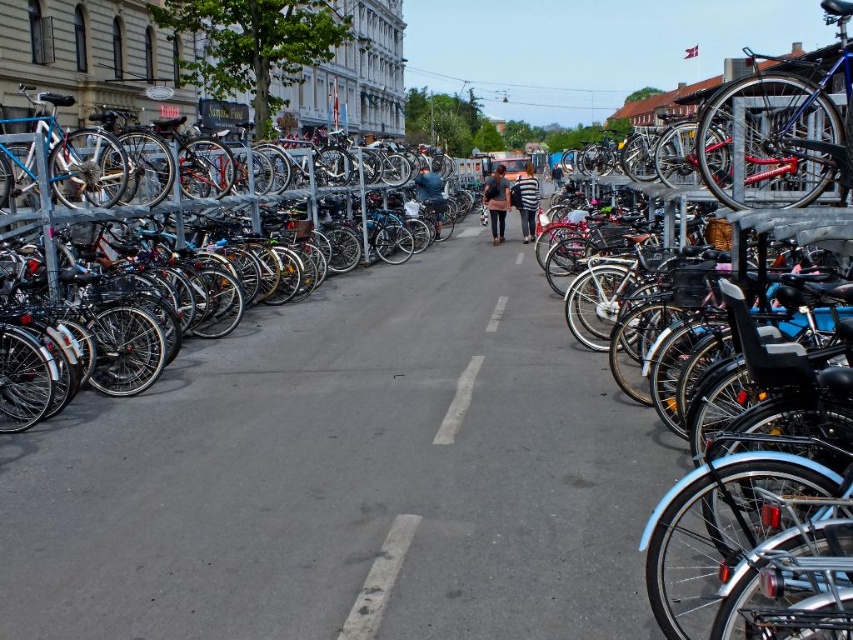
You are a delivery person who needs to pass through the bike parking area. You see the shiny metallic bicycle at left and the dark blue jeans at center. Which object is narrower, allowing you to navigate through more easily?

The shiny metallic bicycle at left is thinner than the dark blue jeans at center, so it is narrower and allows easier navigation.